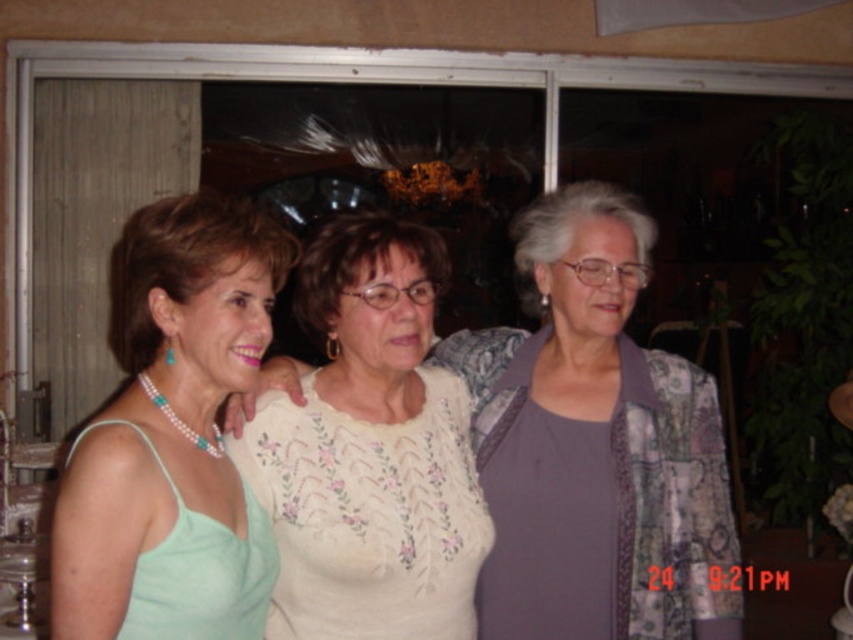
Question: Is purple fabric at center closer to camera compared to white embroidered blouse at center?

Choices:
 (A) yes
 (B) no

Answer: (B)

Question: Which object is positioned closest to the pearl necklace at left?

Choices:
 (A) white embroidered blouse at center
 (B) purple fabric at center

Answer: (A)

Question: Can you confirm if purple fabric at center is smaller than pearl necklace at left?

Choices:
 (A) no
 (B) yes

Answer: (A)

Question: Which of the following is the closest to the observer?

Choices:
 (A) pearl necklace at left
 (B) white embroidered blouse at center
 (C) purple fabric at center

Answer: (A)

Question: Where is purple fabric at center located in relation to pearl necklace at left in the image?

Choices:
 (A) above
 (B) below

Answer: (B)

Question: Among these objects, which one is nearest to the camera?

Choices:
 (A) pearl necklace at left
 (B) white embroidered blouse at center

Answer: (A)